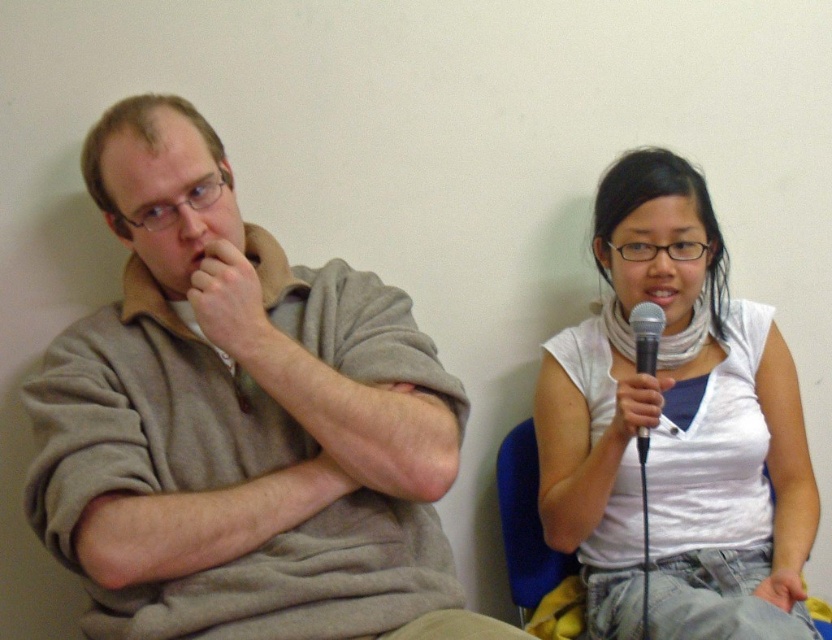
Who is shorter, matte gray sweater at left or white matte scarf at right?

Standing shorter between the two is matte gray sweater at left.

You are a GUI agent. You are given a task and a screenshot of the screen. Output one action in this format:
    pyautogui.click(x=<x>, y=<y>)
    Task: Click on the matte gray sweater at left
    
    Given the screenshot: What is the action you would take?
    pyautogui.click(x=240, y=420)

Which is behind, point (334, 435) or point (674, 589)?

Positioned behind is point (674, 589).

Where is `matte gray sweater at left`? The image size is (832, 640). matte gray sweater at left is located at coordinates (240, 420).

Who is positioned more to the right, matte gray sweater at left or black metallic microphone at upper right?

From the viewer's perspective, black metallic microphone at upper right appears more on the right side.

Can you confirm if matte gray sweater at left is positioned below black metallic microphone at upper right?

Correct, matte gray sweater at left is located below black metallic microphone at upper right.

Is point (132, 280) less distant than point (641, 467)?

No, it is behind (641, 467).

Find the location of a particular element. This screenshot has width=832, height=640. matte gray sweater at left is located at coordinates (240, 420).

Does white matte scarf at right lie behind black metallic microphone at upper right?

No, it is in front of black metallic microphone at upper right.

Who is higher up, white matte scarf at right or black metallic microphone at upper right?

black metallic microphone at upper right is higher up.

Is point (642, 541) farther from viewer compared to point (654, 374)?

Yes, point (642, 541) is behind point (654, 374).

What are the coordinates of `white matte scarf at right` in the screenshot? It's located at (675, 429).